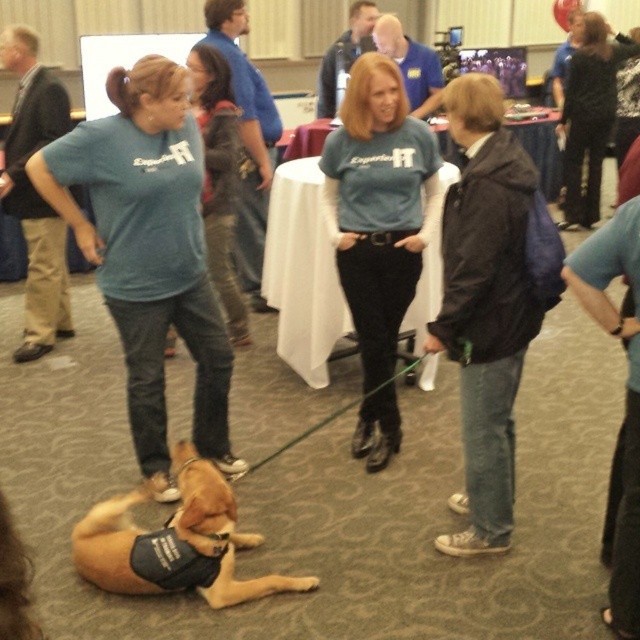
Between point (140, 141) and point (502, 244), which one is positioned in front?

Point (502, 244) is in front.

Between point (202, 381) and point (520, 332), which one is positioned behind?

Point (202, 381)

This screenshot has width=640, height=640. I want to click on matte blue shirt at center, so click(148, 252).

Does dark blue jacket at center-right have a lesser height compared to blue cotton shirt at center?

Yes, dark blue jacket at center-right is shorter than blue cotton shirt at center.

Is dark blue jacket at center-right to the right of blue cotton shirt at center from the viewer's perspective?

Correct, you'll find dark blue jacket at center-right to the right of blue cotton shirt at center.

What do you see at coordinates (484, 305) in the screenshot?
I see `dark blue jacket at center-right` at bounding box center [484, 305].

The image size is (640, 640). Identify the location of dark blue jacket at center-right. (484, 305).

Measure the distance between matte blue shirt at center and blue cotton shirt at center.

They are 29.32 inches apart.

Which of these two, matte blue shirt at center or blue cotton shirt at center, stands shorter?

With less height is matte blue shirt at center.

Image resolution: width=640 pixels, height=640 pixels. I want to click on matte blue shirt at center, so click(148, 252).